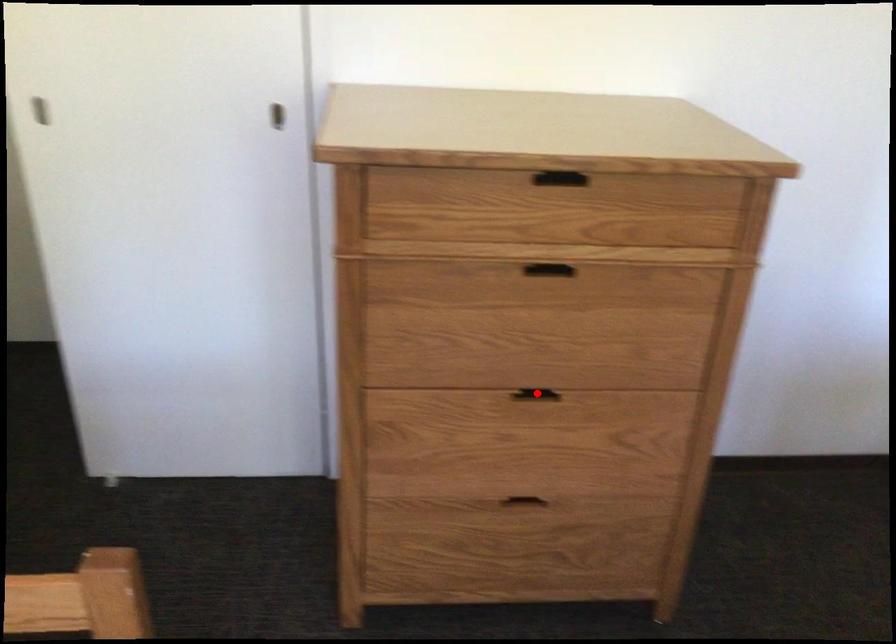
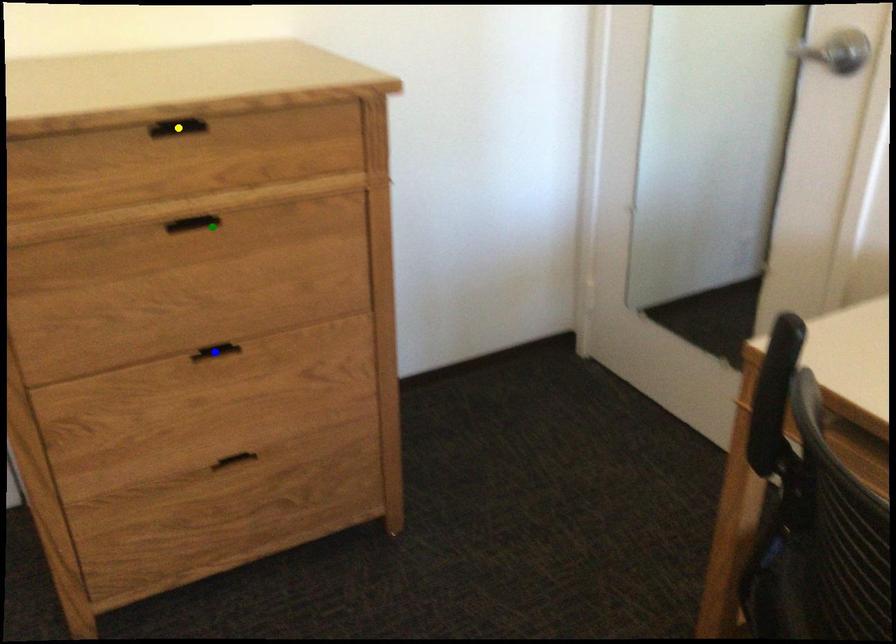
Question: I am providing you with two images of the same scene from different viewpoints. A red point is marked on the first image. You are given multiple points on the second image. In image 2, which mark is for the same physical point as the one in image 1?

Choices:
 (A) blue point
 (B) yellow point
 (C) green point

Answer: (A)